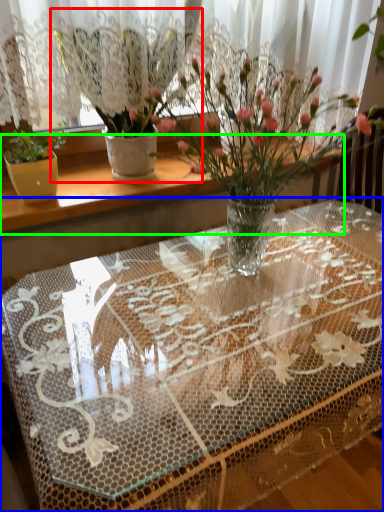
Question: Which object is positioned farthest from houseplant (highlighted by a red box)? Select from table (highlighted by a blue box) and window sill (highlighted by a green box).

Choices:
 (A) table
 (B) window sill

Answer: (A)